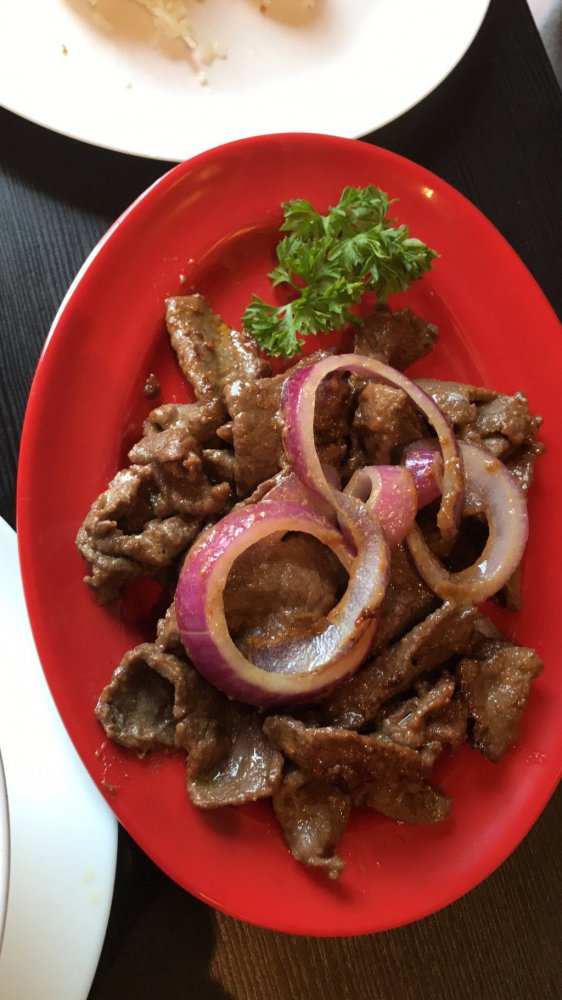
The image size is (562, 1000). I want to click on wood grain surface, so click(395, 963).